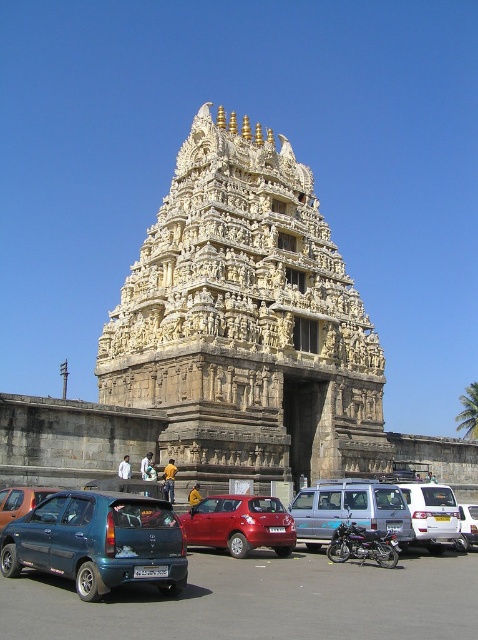
Question: Is white stone temple at center behind white matte van at lower right?

Choices:
 (A) yes
 (B) no

Answer: (A)

Question: Which object is closer to the camera taking this photo?

Choices:
 (A) white stone temple at center
 (B) shiny black motorcycle at center
 (C) white matte van at lower right
 (D) matte blue hatchback at lower left

Answer: (D)

Question: Which point is closer to the camera?

Choices:
 (A) white matte van at lower right
 (B) white matte van at center
 (C) metallic red hatchback at center

Answer: (C)

Question: Which of these objects is positioned closest to the silver metallic van at center?

Choices:
 (A) light blue fabric at center
 (B) denim jacket at lower center
 (C) shiny black motorcycle at center
 (D) white matte van at center

Answer: (C)

Question: Does metallic red hatchback at center have a greater width compared to white matte van at lower right?

Choices:
 (A) no
 (B) yes

Answer: (B)

Question: Does denim jacket at lower center have a larger size compared to yellow fabric person at center?

Choices:
 (A) no
 (B) yes

Answer: (B)